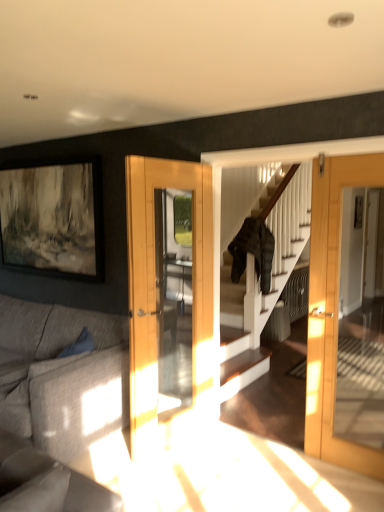
The width and height of the screenshot is (384, 512). Identify the location of textured gray fabric couch at left. tap(57, 404).

The width and height of the screenshot is (384, 512). What do you see at coordinates (57, 404) in the screenshot?
I see `textured gray fabric couch at left` at bounding box center [57, 404].

The image size is (384, 512). I want to click on textured gray fabric couch at left, so click(57, 404).